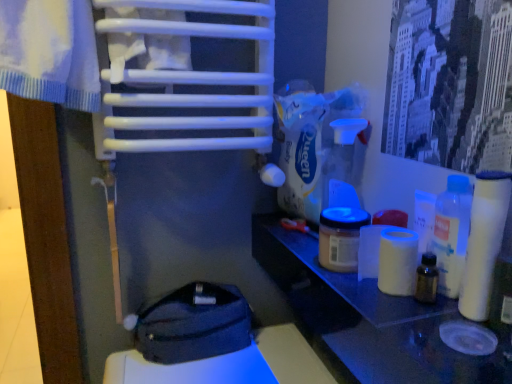
Locate an element on the screen. free location in front of matte plastic jar at center is located at coordinates (373, 308).